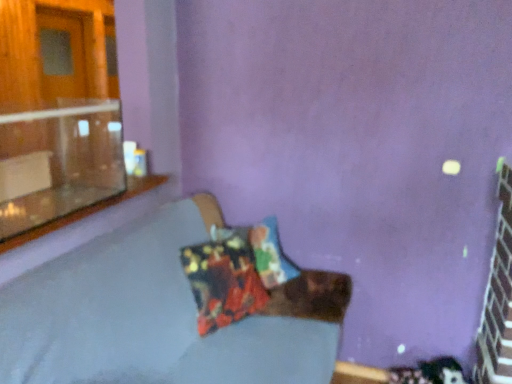
Locate an element on the screen. free point below transparent glass window at upper left (from a real-world perspective) is located at coordinates (46, 214).